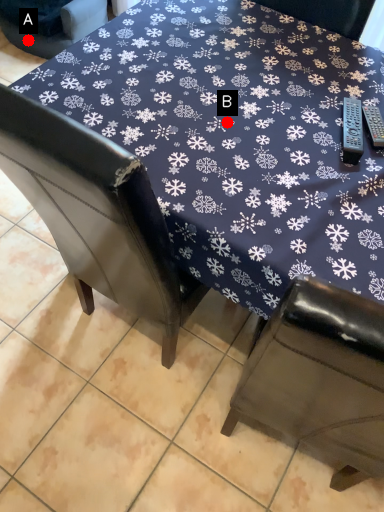
Question: Two points are circled on the image, labeled by A and B beside each circle. Which point is farther to the camera?

Choices:
 (A) A is further
 (B) B is further

Answer: (A)